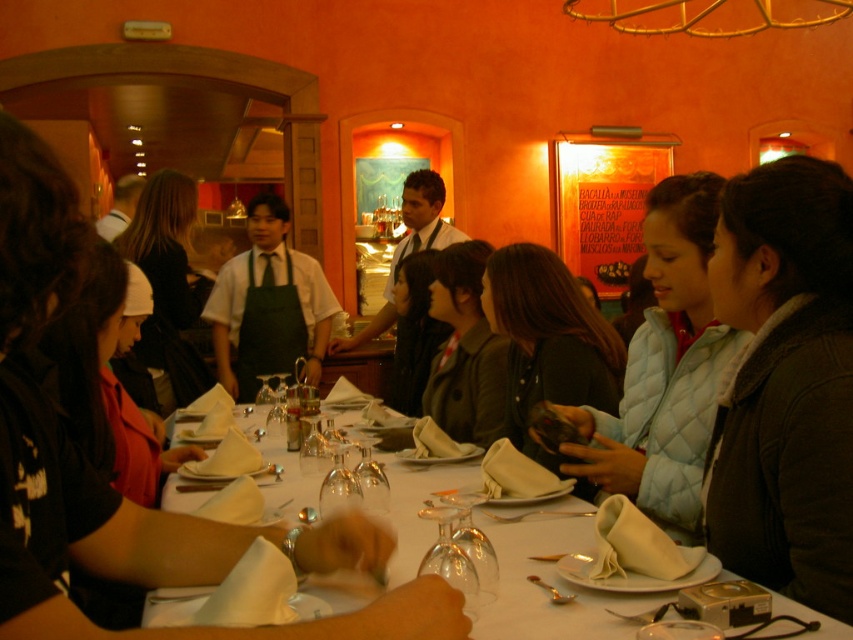
You are a waiter in a restaurant and need to place a drink order slip between the dark brown leather jacket at center and the shiny silver spoon at table center. Can you fit it there?

The dark brown leather jacket at center is to the left of the shiny silver spoon at table center, so there is space between them to place the drink order slip.

You are a server in the restaurant and need to place a new wine glass at the center of the table. However, there is already an object in the way. Which object at the center is closer to you, the matte black phone at center or the transparent glass wine glass at center?

The matte black phone at center is closer to you than the transparent glass wine glass at center, so you should move the matte black phone at center to place the new wine glass.